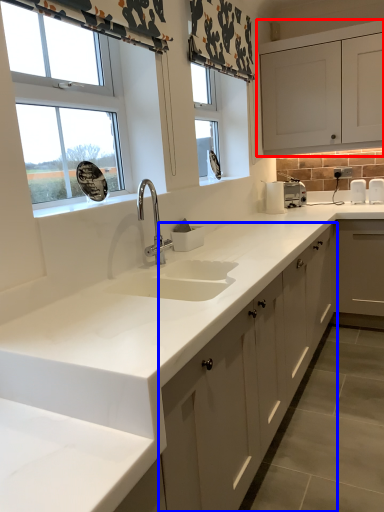
Question: Among these objects, which one is nearest to the camera, cabinetry (highlighted by a red box) or cabinetry (highlighted by a blue box)?

Choices:
 (A) cabinetry
 (B) cabinetry

Answer: (B)